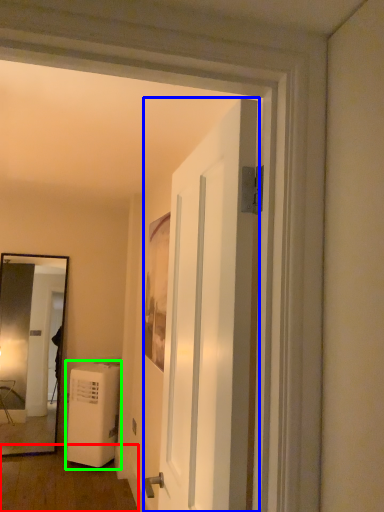
Question: Which object is the farthest from corridor (highlighted by a red box)? Choose among these: door (highlighted by a blue box) or air conditioner (highlighted by a green box).

Choices:
 (A) door
 (B) air conditioner

Answer: (A)